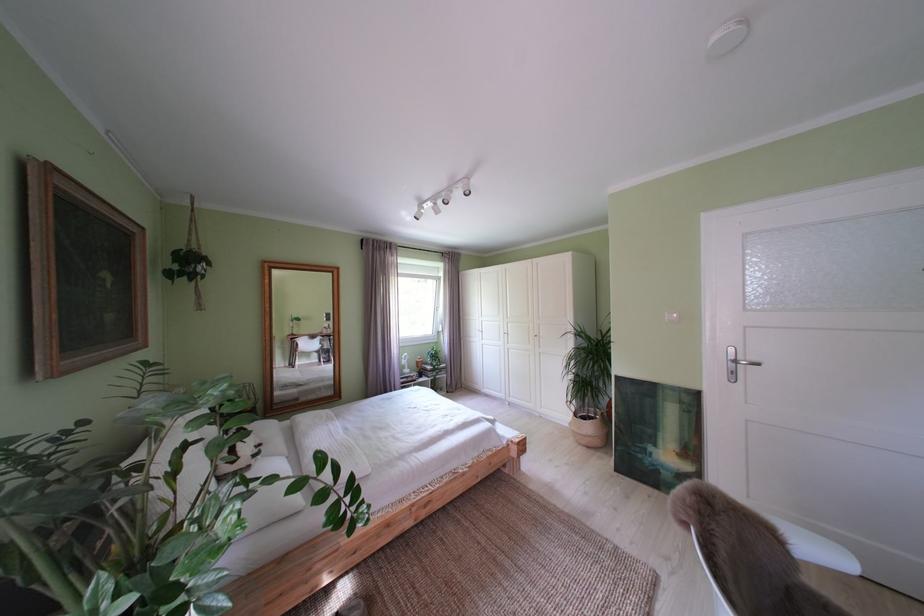
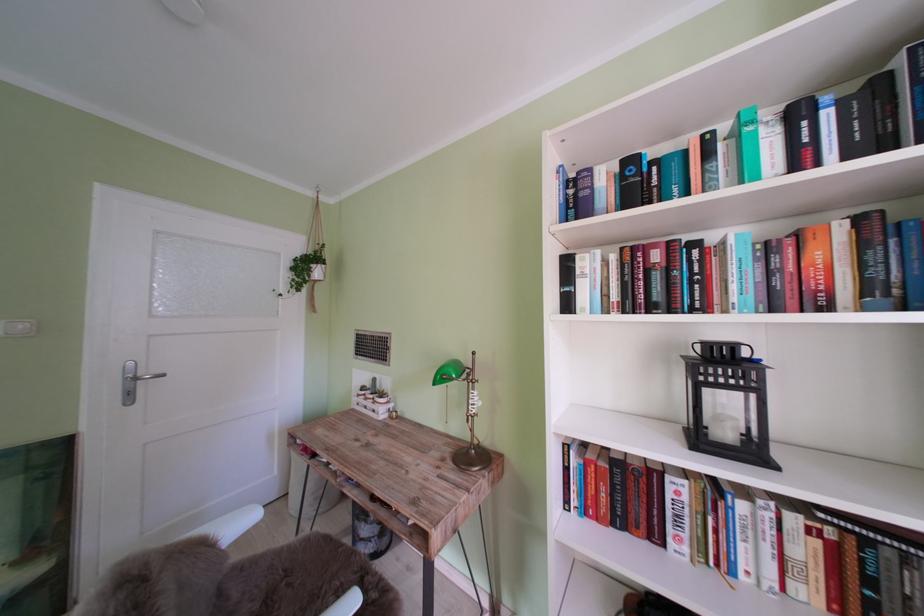
Question: The camera is either moving clockwise (left) or counter-clockwise (right) around the object. The first image is from the beginning of the video and the second image is from the end. Is the camera moving left or right when shooting the video?

Choices:
 (A) Left
 (B) Right

Answer: (A)